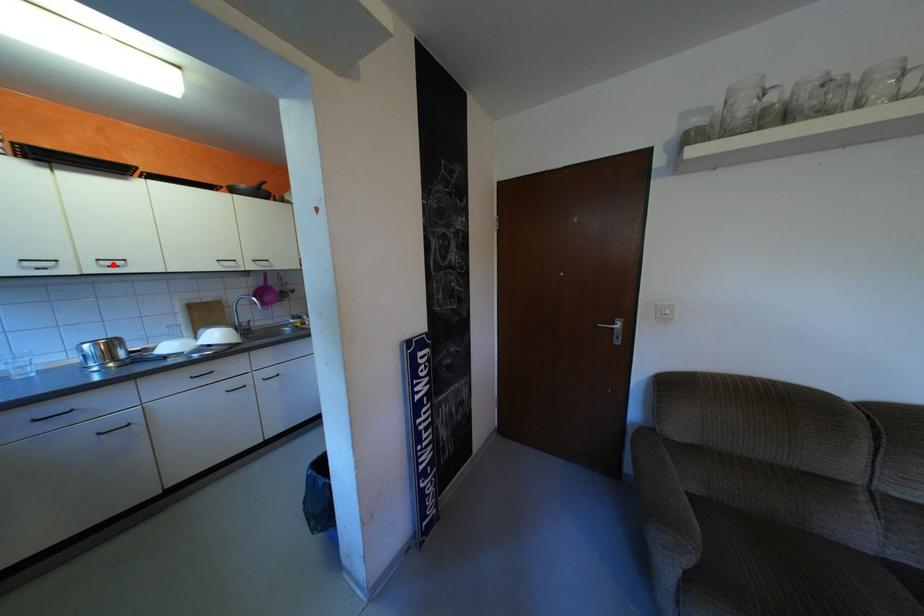
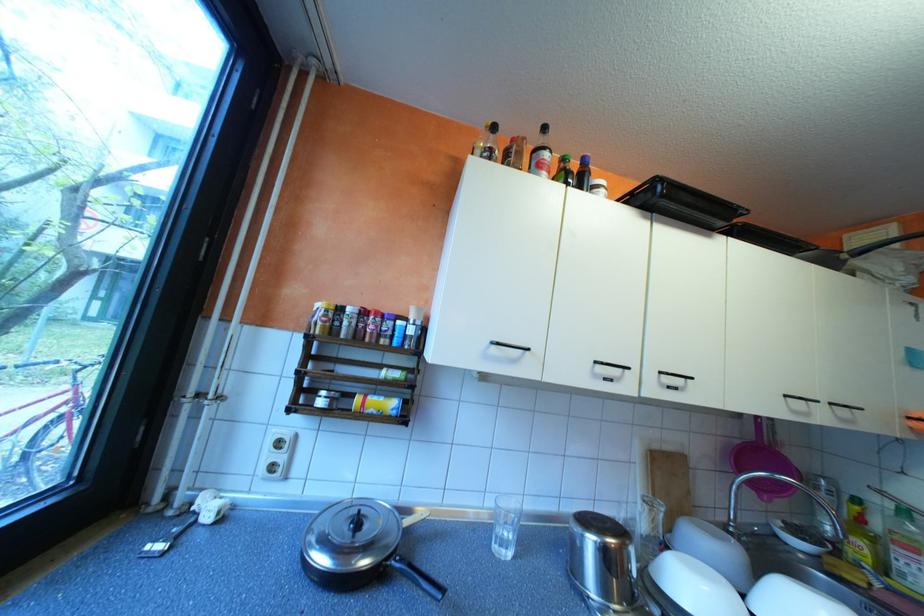
Question: I am providing you with two images of the same scene from different viewpoints. A red point is marked on the first image. Can you still see the location of the red point in image 2?

Choices:
 (A) Yes
 (B) No

Answer: (A)